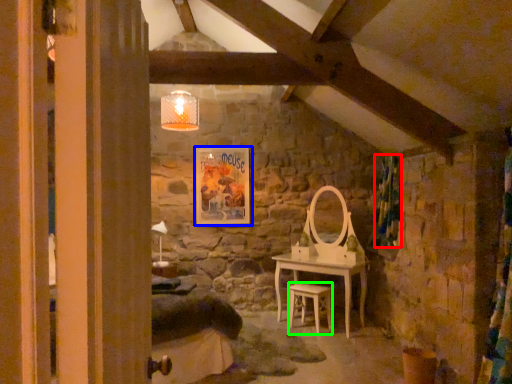
Question: Estimate the real-world distances between objects in this image. Which object is farther from curtain (highlighted by a red box), picture frame (highlighted by a blue box) or chair (highlighted by a green box)?

Choices:
 (A) picture frame
 (B) chair

Answer: (A)